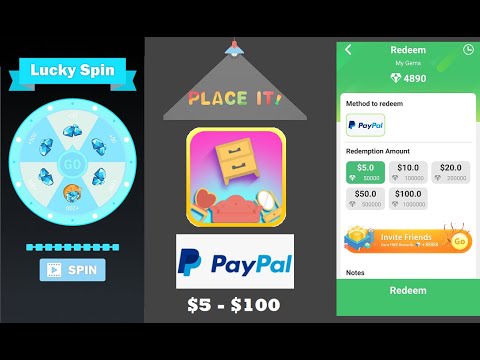
This screenshot has width=480, height=360. I want to click on left front leg, so click(258, 174).